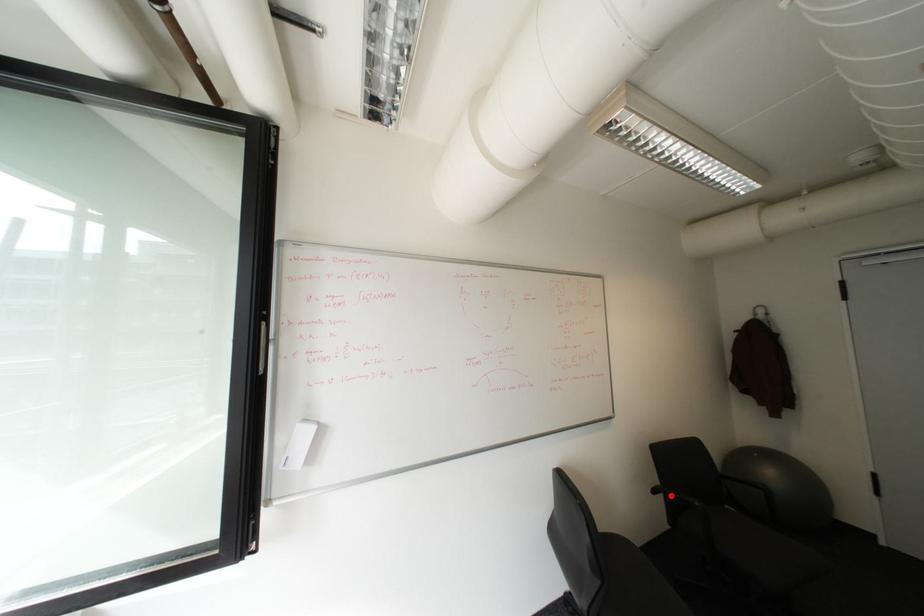
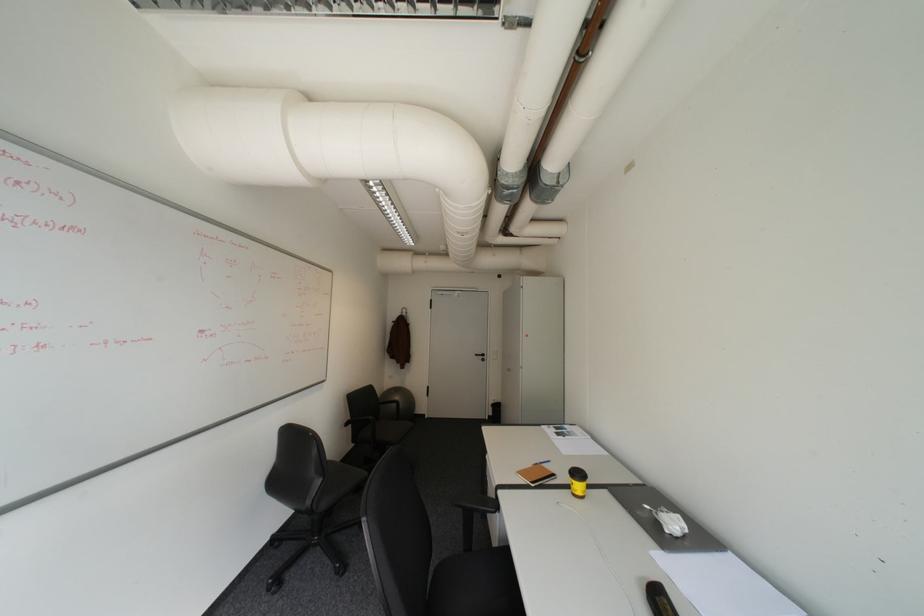
Question: I am providing you with two images of the same scene from different viewpoints. Image1 has a red point marked. In image2, the corresponding 3D location appears at what relative position? Reply with the corresponding letter.

Choices:
 (A) Closer
 (B) Farther

Answer: (A)